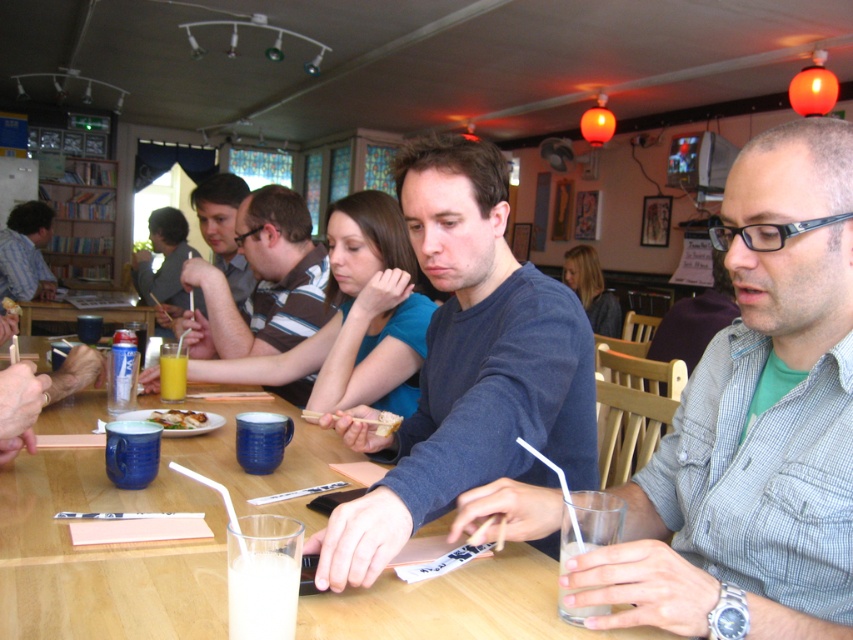
In the scene shown: Who is higher up, matte black shirt at center or clear plastic cup at lower center?

Positioned higher is matte black shirt at center.

Who is lower down, matte black shirt at center or clear plastic cup at lower center?

clear plastic cup at lower center is lower down.

Which is behind, point (167, 298) or point (573, 612)?

The point (167, 298) is more distant.

Where is `matte black shirt at center`? This screenshot has width=853, height=640. matte black shirt at center is located at coordinates (163, 259).

Does white bread at center have a lesser height compared to matte brown plate at center?

Correct, white bread at center is not as tall as matte brown plate at center.

Who is more distant from viewer, (399, 416) or (12, 312)?

The point (12, 312) is more distant.

Which is in front, point (381, 429) or point (13, 305)?

Positioned in front is point (381, 429).

At what (x,y) coordinates should I click in order to perform the action: click on white bread at center. Please return your answer as a coordinate pair (x, y). Looking at the image, I should click on (387, 422).

What do you see at coordinates (264, 280) in the screenshot? This screenshot has height=640, width=853. I see `striped cotton shirt at center` at bounding box center [264, 280].

Who is more forward, (195, 348) or (4, 305)?

Point (195, 348)

The height and width of the screenshot is (640, 853). What are the coordinates of `striped cotton shirt at center` in the screenshot? It's located at (264, 280).